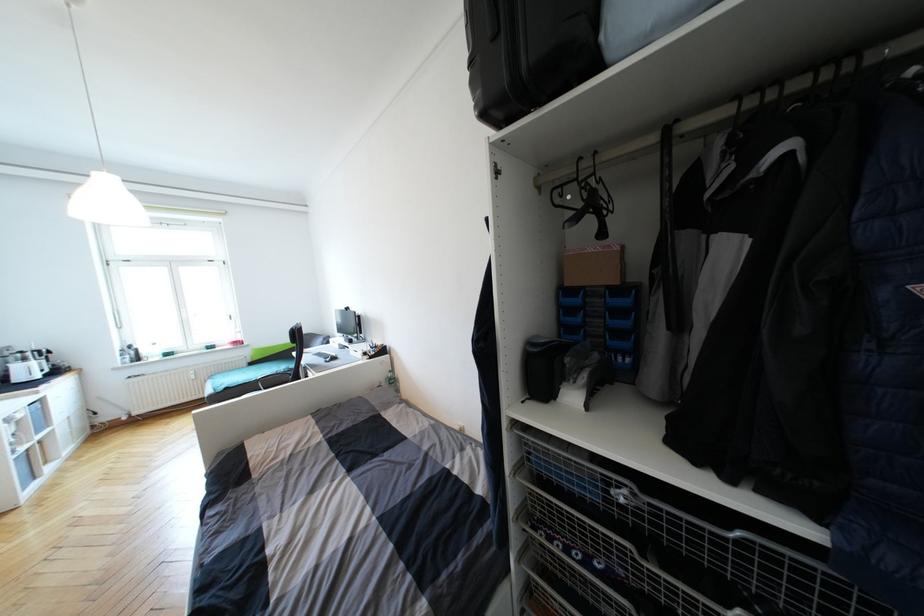
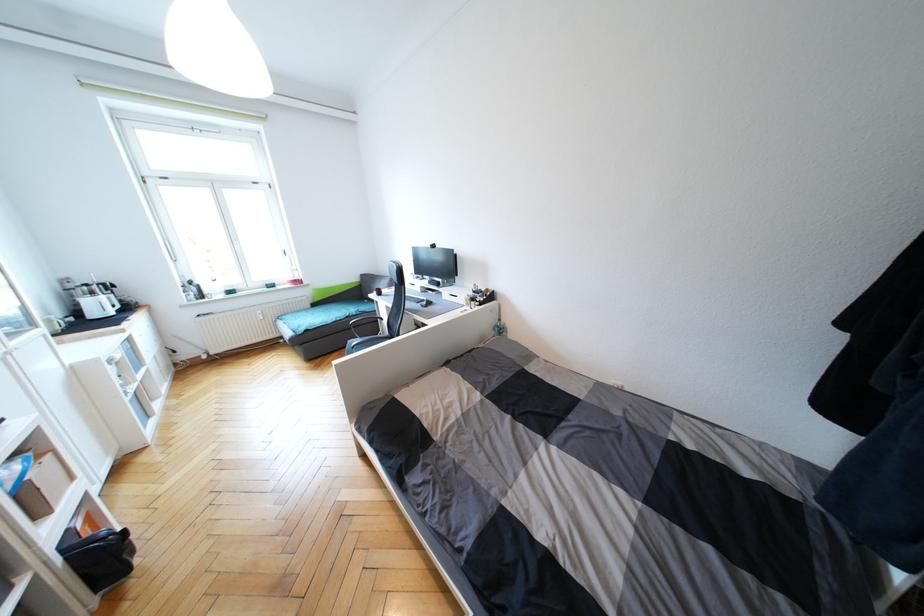
Locate, in the second image, the point that corresponds to point (254, 365) in the first image.

(319, 306)